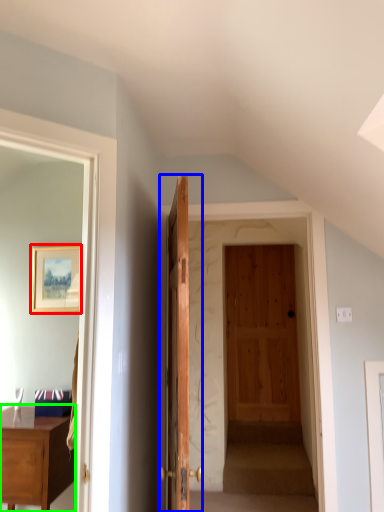
Question: Based on their relative distances, which object is nearer to picture frame (highlighted by a red box)? Choose from door (highlighted by a blue box) and desk (highlighted by a green box).

Choices:
 (A) door
 (B) desk

Answer: (A)